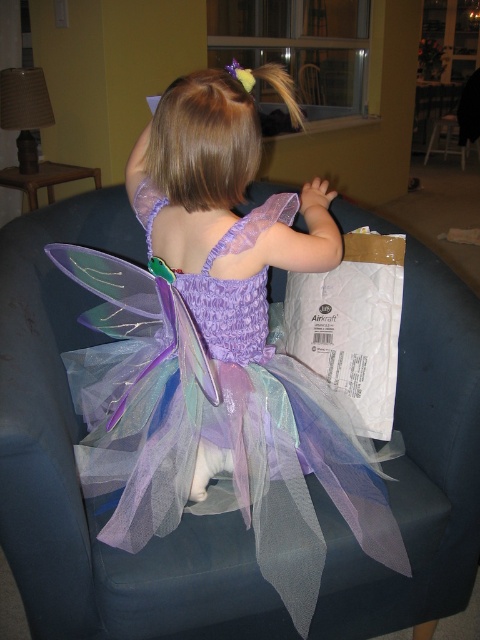
Is translucent tulle dress at center smaller than white paper bag at right?

Incorrect, translucent tulle dress at center is not smaller in size than white paper bag at right.

Between point (316, 552) and point (312, 289), which one is positioned in front?

Point (316, 552) is in front.

Locate an element on the screen. translucent tulle dress at center is located at coordinates (218, 353).